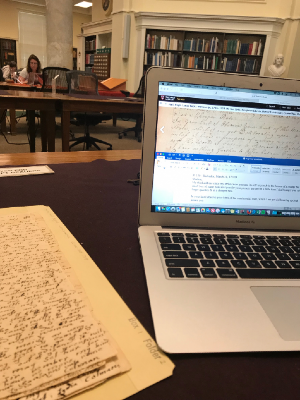
The width and height of the screenshot is (300, 400). I want to click on table, so click(73, 156).